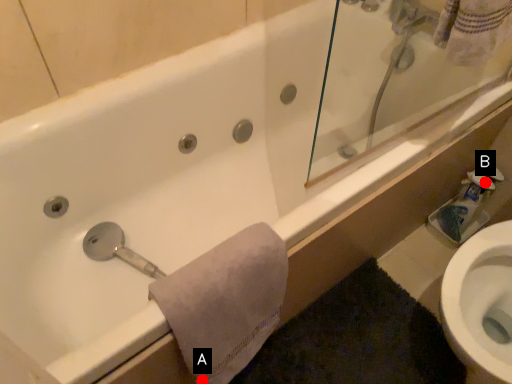
Question: Two points are circled on the image, labeled by A and B beside each circle. Which of the following is the farthest from the observer?

Choices:
 (A) A is further
 (B) B is further

Answer: (B)